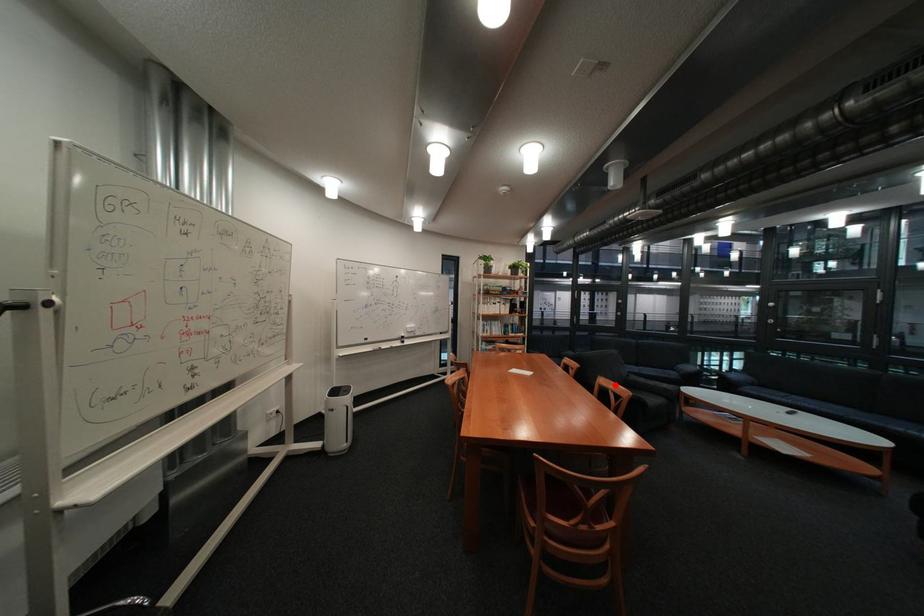
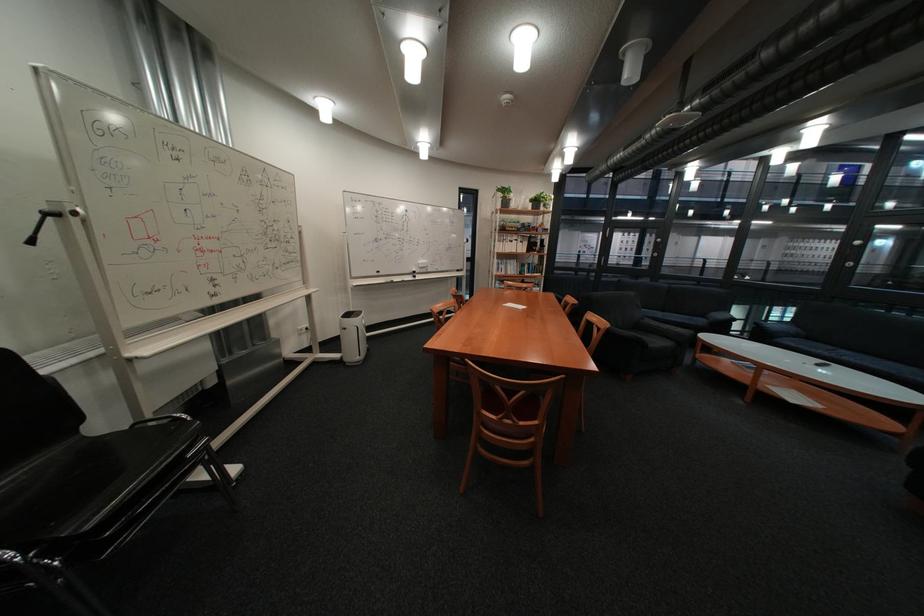
Question: I am providing you with two images of the same scene from different viewpoints. A red point is shown in image1. For the corresponding object point in image2, is it positioned nearer or farther from the camera?

Choices:
 (A) Nearer
 (B) Farther

Answer: (A)